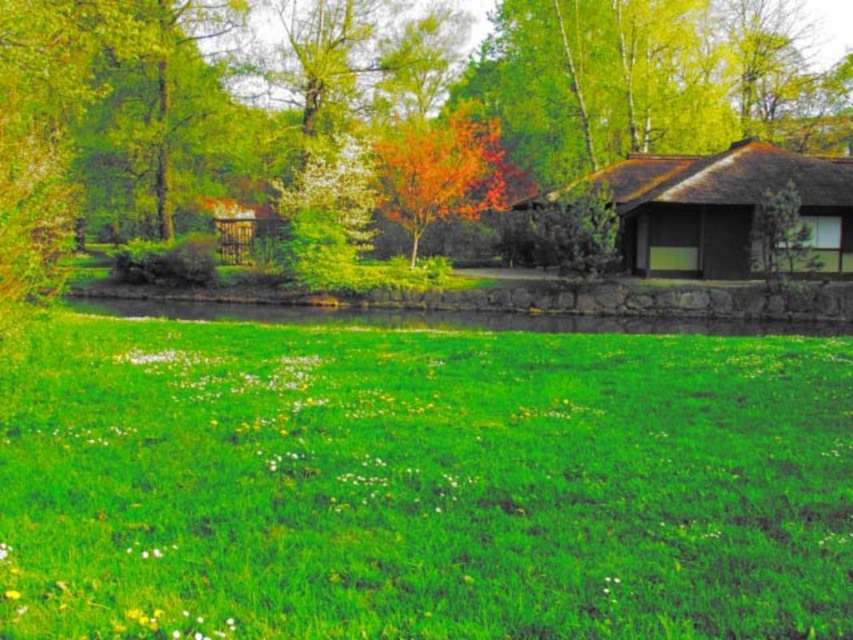
Question: Among these points, which one is nearest to the camera?

Choices:
 (A) (447, 136)
 (B) (473, 470)
 (C) (753, 182)

Answer: (B)

Question: Which object is positioned farthest from the autumn leaves tree at center?

Choices:
 (A) brown thatched hut at upper right
 (B) green grass at center

Answer: (B)

Question: Is green grass at center below brown thatched hut at upper right?

Choices:
 (A) no
 (B) yes

Answer: (B)

Question: In this image, where is green grass at center located relative to autumn leaves tree at center?

Choices:
 (A) below
 (B) above

Answer: (A)

Question: Does green grass at center have a greater width compared to brown thatched hut at upper right?

Choices:
 (A) yes
 (B) no

Answer: (B)

Question: Which object is positioned closest to the autumn leaves tree at center?

Choices:
 (A) green grass at center
 (B) brown thatched hut at upper right

Answer: (B)